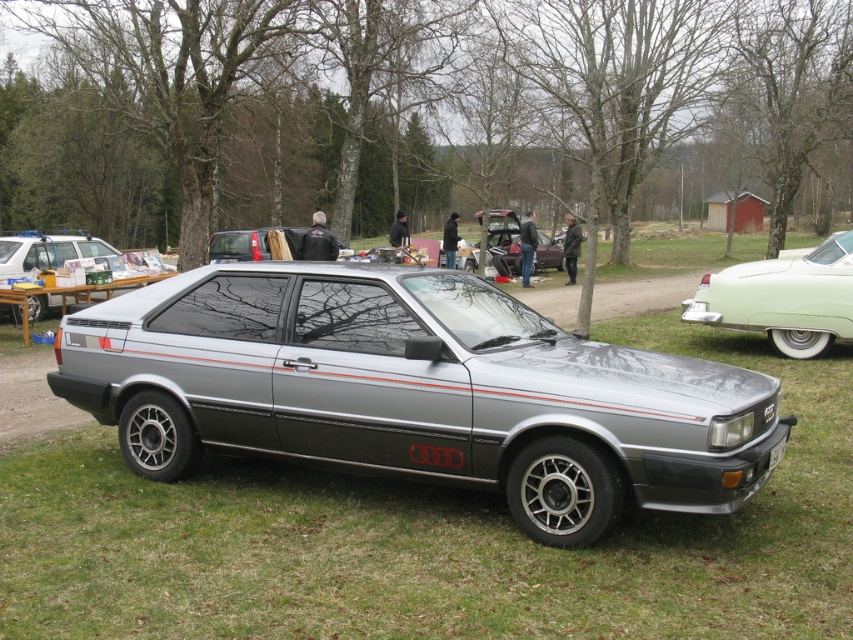
You are organizing a car boot sale and need to park two cars, the satin silver car at center and the metallic silver car at center, side by side in a space that is 4 meters wide. Can both cars fit if they are placed next to each other?

The satin silver car at center is wider than the metallic silver car at center. If the combined width of both cars is less than or equal to 4 meters, they can fit. However, without knowing their exact widths, it is impossible to determine definitively.

You are standing at the point with coordinates (45, 252) in the image. What object are you directly at?

The point at coordinates (45, 252) corresponds to the satin silver car at center.

You are standing at the point with coordinates point (x=39, y=308) and want to walk towards the vintage Audi car. Is the point point (x=796, y=262) located in front of you or behind you?

The point (x=796, y=262) is in front of point (x=39, y=308), so it is located in front of you.